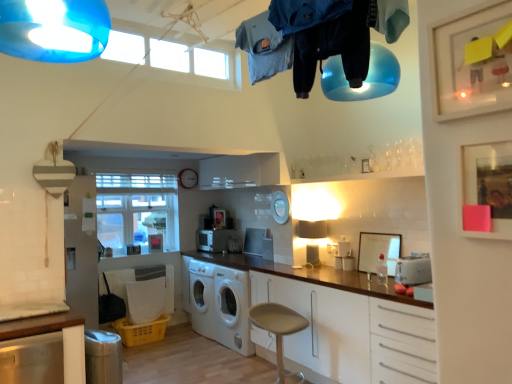
Image resolution: width=512 pixels, height=384 pixels. I want to click on vacant space situated above white matte picture frame at right, the 2th picture frame in the top-to-bottom sequence (from a real-world perspective), so click(x=379, y=233).